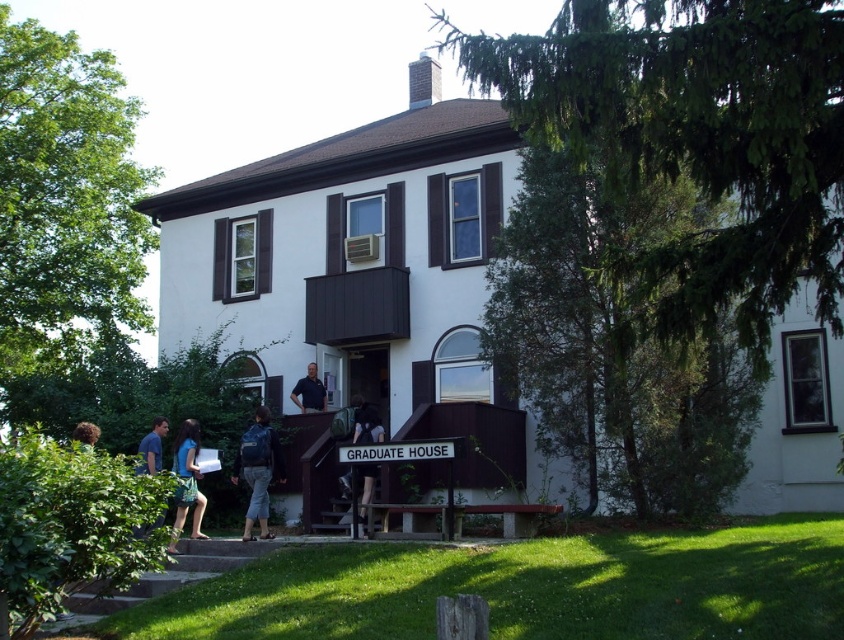
Question: Estimate the real-world distances between objects in this image. Which object is farther from the curly brown hair at lower left?

Choices:
 (A) blue fabric dress at lower left
 (B) dark blue backpack at center

Answer: (B)

Question: Does dark blue backpack at center have a greater width compared to curly brown hair at lower left?

Choices:
 (A) no
 (B) yes

Answer: (A)

Question: Which point is farther to the camera?

Choices:
 (A) (312, 400)
 (B) (89, 432)
 (C) (365, 440)
 (D) (158, 518)

Answer: (A)

Question: Does dark blue shirt at center have a lesser width compared to curly brown hair at lower left?

Choices:
 (A) no
 (B) yes

Answer: (B)

Question: Is denim pants at center thinner than blue fabric dress at lower left?

Choices:
 (A) no
 (B) yes

Answer: (B)

Question: Which point is farther to the camera?

Choices:
 (A) (241, 538)
 (B) (145, 445)
 (C) (318, 396)
 (D) (369, 468)

Answer: (C)